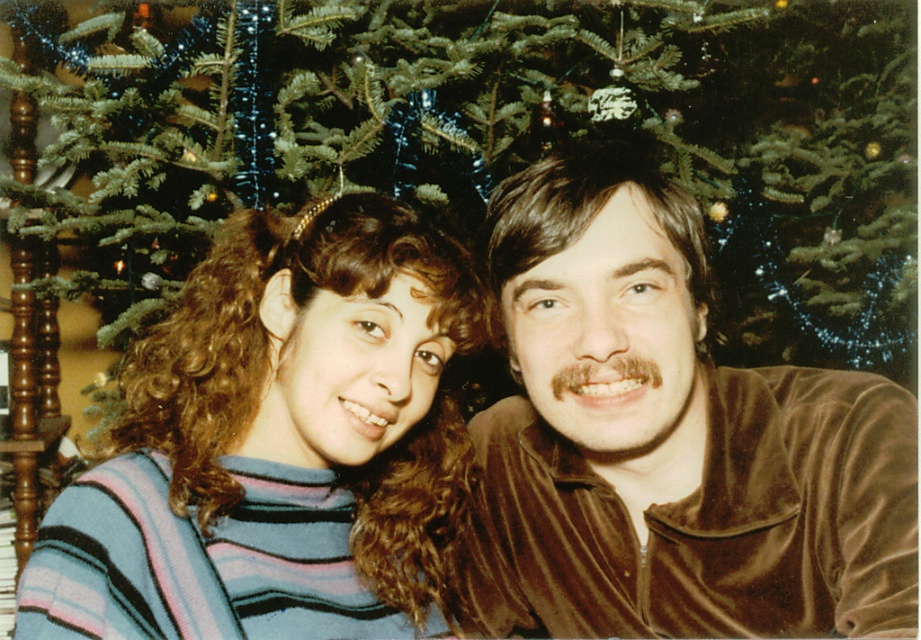
Question: Is green matte christmas tree at center below striped sweater at center?

Choices:
 (A) yes
 (B) no

Answer: (B)

Question: Which point is farther to the camera?

Choices:
 (A) velvet brown shirt at center
 (B) green matte christmas tree at center
 (C) striped sweater at center

Answer: (B)

Question: Which point is closer to the camera taking this photo?

Choices:
 (A) (392, 157)
 (B) (407, 468)
 (C) (638, 481)

Answer: (B)

Question: Is the position of green matte christmas tree at center more distant than that of velvet brown shirt at center?

Choices:
 (A) yes
 (B) no

Answer: (A)

Question: Estimate the real-world distances between objects in this image. Which object is closer to the velvet brown shirt at center?

Choices:
 (A) striped sweater at center
 (B) green matte christmas tree at center

Answer: (A)

Question: Is green matte christmas tree at center thinner than striped sweater at center?

Choices:
 (A) no
 (B) yes

Answer: (A)